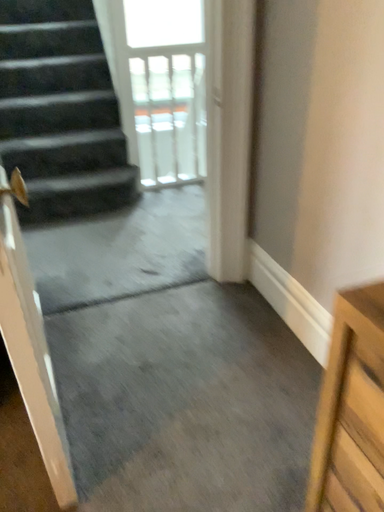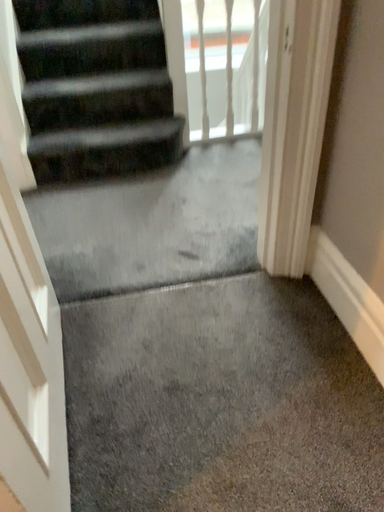
Question: How did the camera likely rotate when shooting the video?

Choices:
 (A) rotated downward
 (B) rotated upward

Answer: (A)